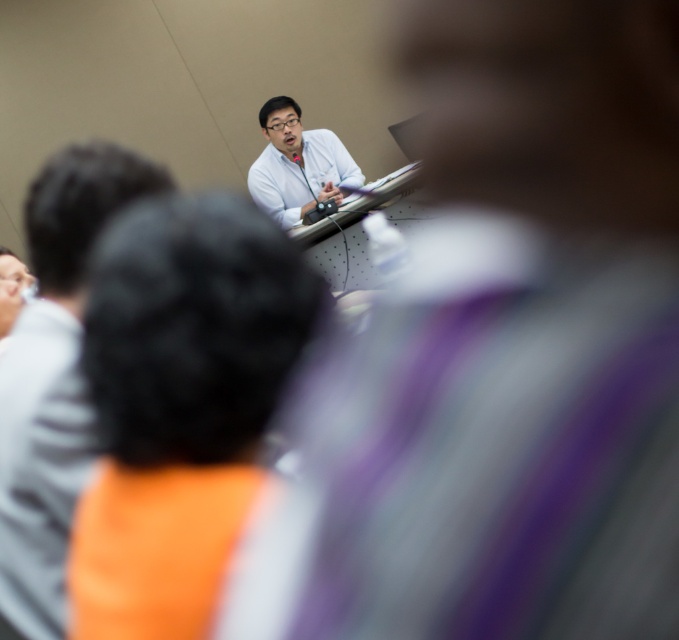
Does matte white shirt at upper center have a smaller size compared to white glossy shirt at center?

Yes.

Between matte white shirt at upper center and white glossy shirt at center, which one has more height?

white glossy shirt at center is taller.

Does point (62, 534) come closer to viewer compared to point (312, 172)?

Yes, it is in front of point (312, 172).

Locate an element on the screen. matte white shirt at upper center is located at coordinates (54, 376).